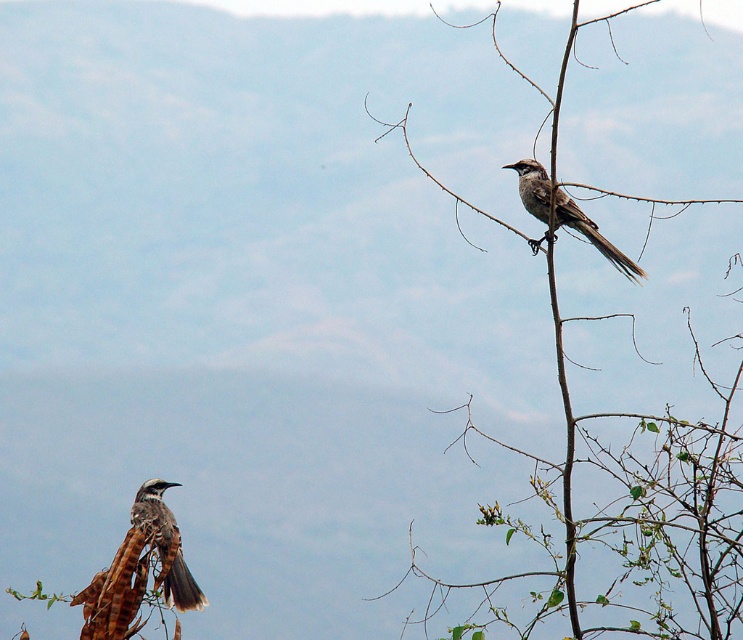
Question: Is gray-brown speckled bird at upper right behind brown speckled feathers at lower left?

Choices:
 (A) no
 (B) yes

Answer: (A)

Question: Among these objects, which one is nearest to the camera?

Choices:
 (A) brown textured branch at upper center
 (B) brown speckled feathers at lower left
 (C) gray-brown speckled bird at upper right

Answer: (A)

Question: Can you confirm if gray-brown speckled bird at upper right is thinner than brown speckled feathers at lower left?

Choices:
 (A) yes
 (B) no

Answer: (B)

Question: Considering the real-world distances, which object is farthest from the brown speckled feathers at lower left?

Choices:
 (A) gray-brown speckled bird at upper right
 (B) brown textured branch at upper center

Answer: (A)

Question: Which of these objects is positioned closest to the gray-brown speckled bird at upper right?

Choices:
 (A) brown speckled feathers at lower left
 (B) brown textured branch at upper center

Answer: (B)

Question: Is brown textured branch at upper center thinner than brown speckled feathers at lower left?

Choices:
 (A) yes
 (B) no

Answer: (B)